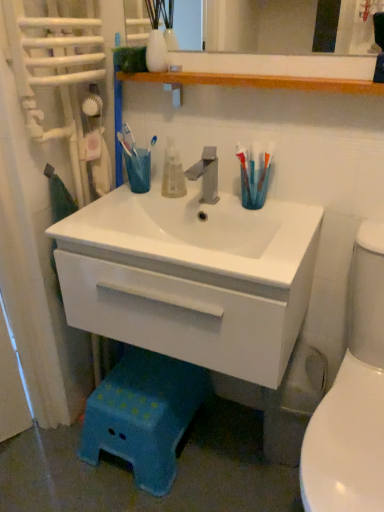
Where is `vacant region above wooden shelf at upper center (from a real-world perspective)`? The image size is (384, 512). vacant region above wooden shelf at upper center (from a real-world perspective) is located at coordinates (273, 73).